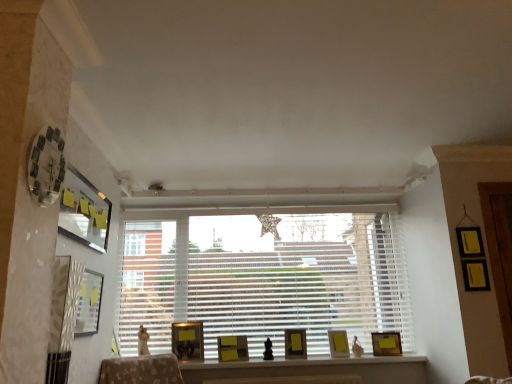
Question: Considering the positions of matte yellow picture frame at center, positioned as the fourth picture frame in left-to-right order, and matte black picture frame at upper left, which ranks as the first picture frame in left-to-right order, in the image, is matte yellow picture frame at center, positioned as the fourth picture frame in left-to-right order, taller or shorter than matte black picture frame at upper left, which ranks as the first picture frame in left-to-right order,?

Choices:
 (A) short
 (B) tall

Answer: (A)

Question: From a real-world perspective, is matte yellow picture frame at center, which is the fourth picture frame in back-to-front order, physically located above or below matte black picture frame at upper left, the seventh picture frame from the right?

Choices:
 (A) below
 (B) above

Answer: (A)

Question: Considering the real-world distances, which object is farthest from the matte yellow picture frame at center, positioned as the second picture frame in back-to-front order?

Choices:
 (A) matte gold picture frame at center, which is counted as the third picture frame, starting from the back
 (B) matte black picture frame at upper left, the 6th picture frame when ordered from back to front
 (C) clear glass clock at upper left, the 1th picture frame when ordered from front to back
 (D) wooden matte picture frame at center, the 7th picture frame positioned from the front
 (E) matte yellow picture frame at center, which is the fourth picture frame in back-to-front order

Answer: (C)

Question: Which of these objects is positioned closest to the matte yellow picture frame at center, which is the fourth picture frame from right to left?

Choices:
 (A) white blinds at center
 (B) matte wooden picture frame at center, arranged as the 3th picture frame when viewed from the front
 (C) matte yellow picture frame at center, marked as the second picture frame in a right-to-left arrangement
 (D) wooden matte picture frame at center, which appears as the seventh picture frame when viewed from the left
 (E) clear glass clock at upper left, which is the second picture frame in left-to-right order

Answer: (B)